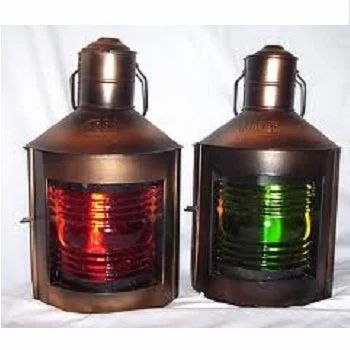
Identify the location of handle. (148, 98).